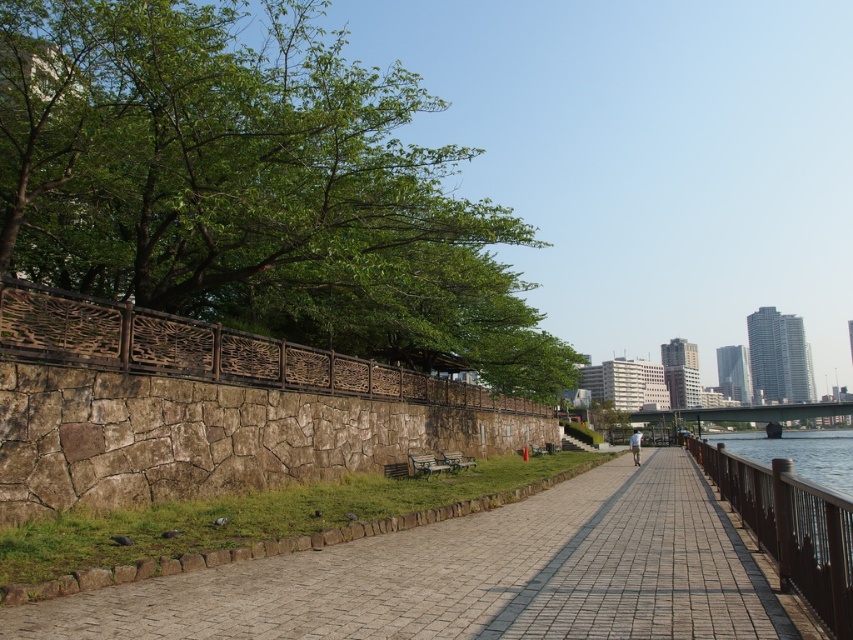
Question: Which object appears farthest from the camera in this image?

Choices:
 (A) green leafy tree at upper left
 (B) brick paved walkway at center
 (C) paved stone walkway at center

Answer: (A)

Question: Is green leafy tree at upper left to the right of brick paved walkway at center from the viewer's perspective?

Choices:
 (A) yes
 (B) no

Answer: (B)

Question: Where is green leafy tree at upper left located in relation to brick paved walkway at center in the image?

Choices:
 (A) left
 (B) right

Answer: (A)

Question: In this image, where is brick paved walkway at center located relative to paved stone walkway at center?

Choices:
 (A) below
 (B) above

Answer: (B)

Question: Which point is closer to the camera?

Choices:
 (A) (624, 636)
 (B) (674, 557)
 (C) (718, 445)
 (D) (444, 189)

Answer: (A)

Question: Which of the following is the farthest from the observer?

Choices:
 (A) (480, 371)
 (B) (831, 528)
 (C) (610, 467)

Answer: (A)